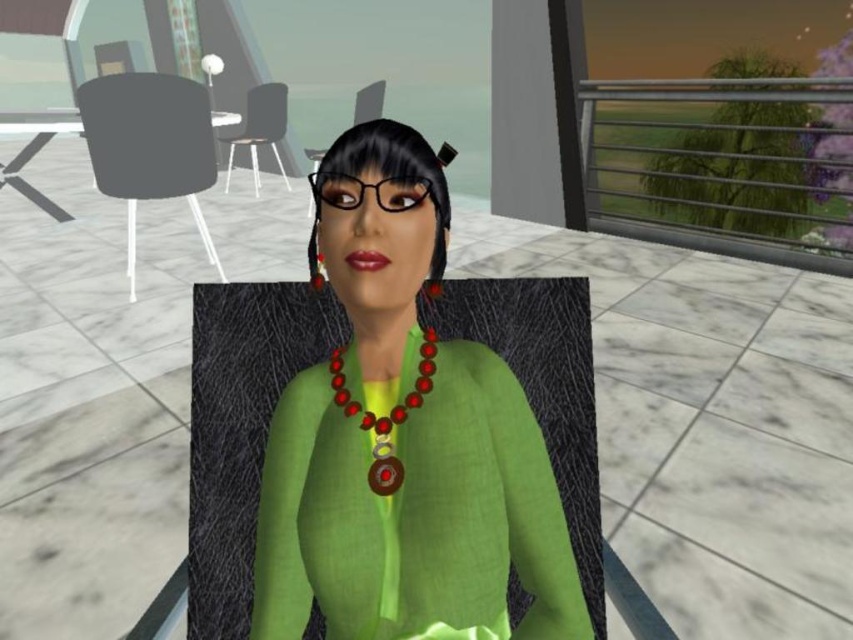
Question: Which of these objects is positioned farthest from the green linen blouse at center?

Choices:
 (A) green fabric armchair at center
 (B) matte black armchair at left

Answer: (B)

Question: Estimate the real-world distances between objects in this image. Which object is closer to the red beaded earring at center?

Choices:
 (A) matte black armchair at upper left
 (B) shiny red beads at center
 (C) matte black armchair at left
 (D) green linen blouse at center

Answer: (B)

Question: Does green linen blouse at center appear over matte black armchair at left?

Choices:
 (A) no
 (B) yes

Answer: (A)

Question: Does green linen blouse at center appear under matte black armchair at left?

Choices:
 (A) no
 (B) yes

Answer: (B)

Question: Is matte black armchair at left to the right of green fabric armchair at center from the viewer's perspective?

Choices:
 (A) no
 (B) yes

Answer: (B)

Question: Based on their relative distances, which object is nearer to the matte black armchair at upper left?

Choices:
 (A) red beaded earring at center
 (B) green fabric armchair at center

Answer: (B)